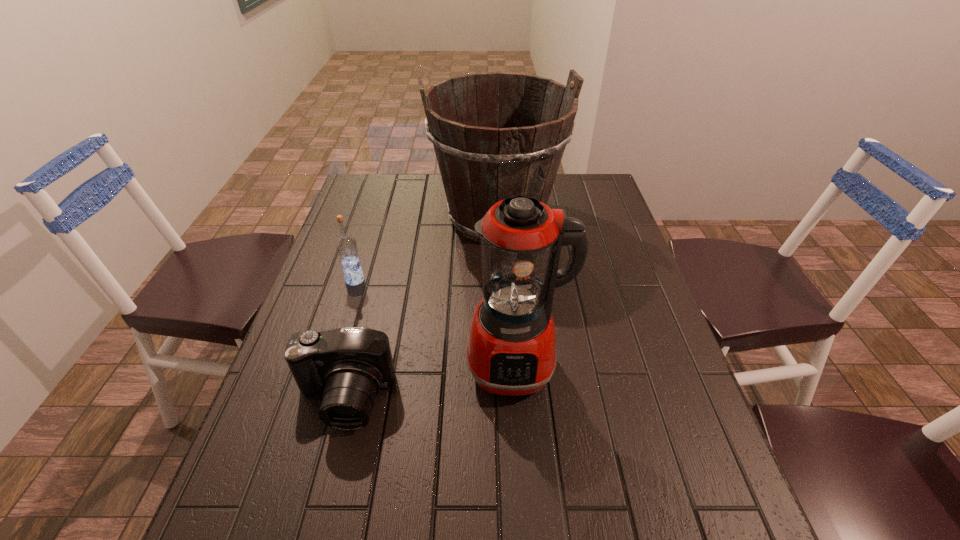
Where is `empty space that is in between the food processor and the shortest object`? The image size is (960, 540). empty space that is in between the food processor and the shortest object is located at coordinates (429, 383).

I want to click on empty space between the camera and the food processor, so click(x=429, y=383).

This screenshot has width=960, height=540. I want to click on empty space that is in between the farthest object and the shortest object, so click(x=420, y=308).

Where is `unoccupied area between the vodka and the farthest object`? The height and width of the screenshot is (540, 960). unoccupied area between the vodka and the farthest object is located at coordinates [x=425, y=248].

The image size is (960, 540). What are the coordinates of `vacant area between the vodka and the food processor` in the screenshot? It's located at (435, 324).

The image size is (960, 540). In order to click on the second closest object to the second shortest object in this screenshot , I will do `click(351, 364)`.

The height and width of the screenshot is (540, 960). Identify the location of object identified as the closest to the vodka. (496, 135).